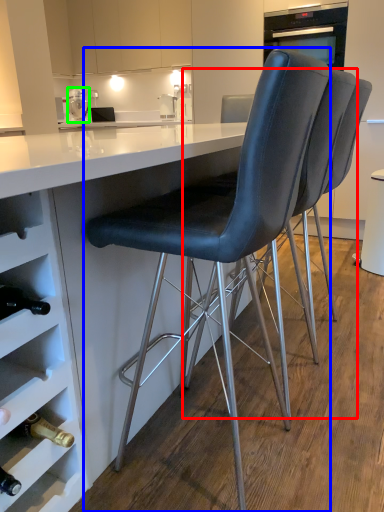
Question: Based on their relative distances, which object is farther from chair (highlighted by a red box)? Choose from chair (highlighted by a blue box) and kitchen appliance (highlighted by a green box).

Choices:
 (A) chair
 (B) kitchen appliance

Answer: (B)